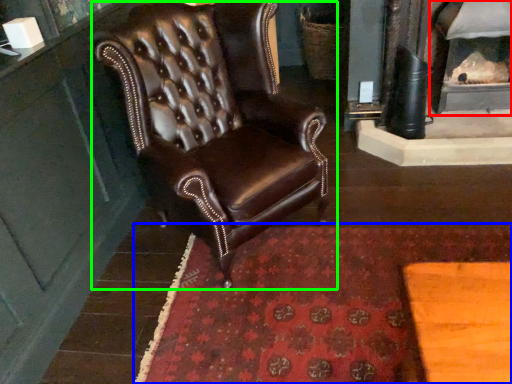
Question: Which is farther away from fireplace (highlighted by a red box)? mat (highlighted by a blue box) or chair (highlighted by a green box)?

Choices:
 (A) mat
 (B) chair

Answer: (B)